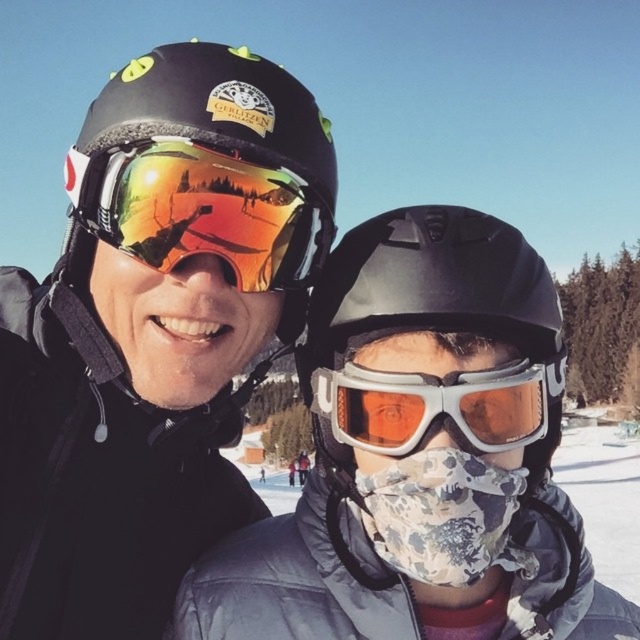
Does matte black helmet at upper center have a greater height compared to matte reflective goggles at center?

Yes, matte black helmet at upper center is taller than matte reflective goggles at center.

Who is more distant from viewer, (275, 72) or (138, 259)?

The point (275, 72) is behind.

The width and height of the screenshot is (640, 640). I want to click on matte black helmet at upper center, so click(198, 211).

Which is in front, point (378, 273) or point (365, 376)?

Point (365, 376) is more forward.

Which is in front, point (483, 260) or point (404, 376)?

Point (404, 376)

I want to click on matte black helmet at center, so click(x=436, y=291).

Which is in front, point (212, 250) or point (362, 372)?

Point (362, 372) is in front.

Identify the location of matte black helmet at upper center. (198, 211).

At what (x,y) coordinates should I click in order to perform the action: click on matte black helmet at upper center. Please return your answer as a coordinate pair (x, y). Looking at the image, I should click on (198, 211).